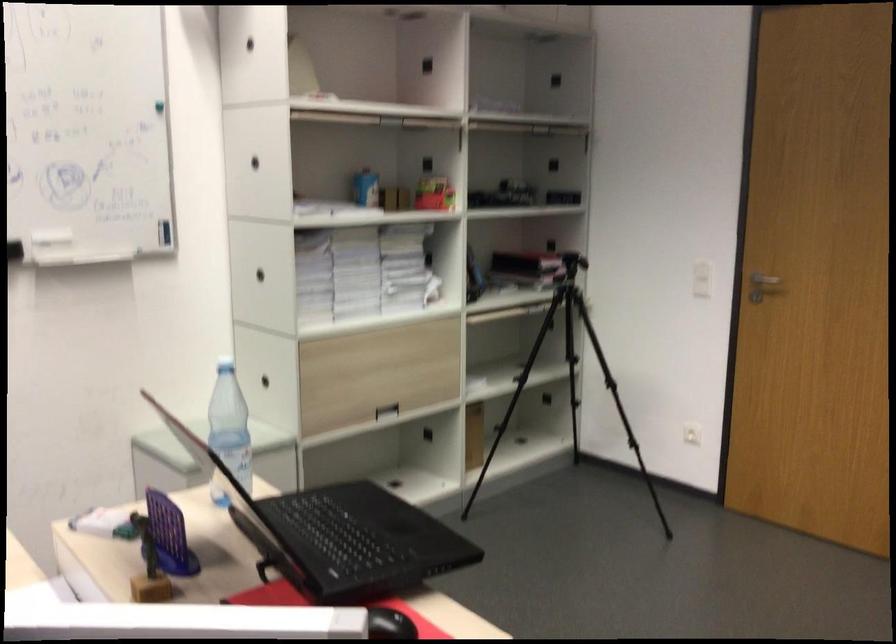
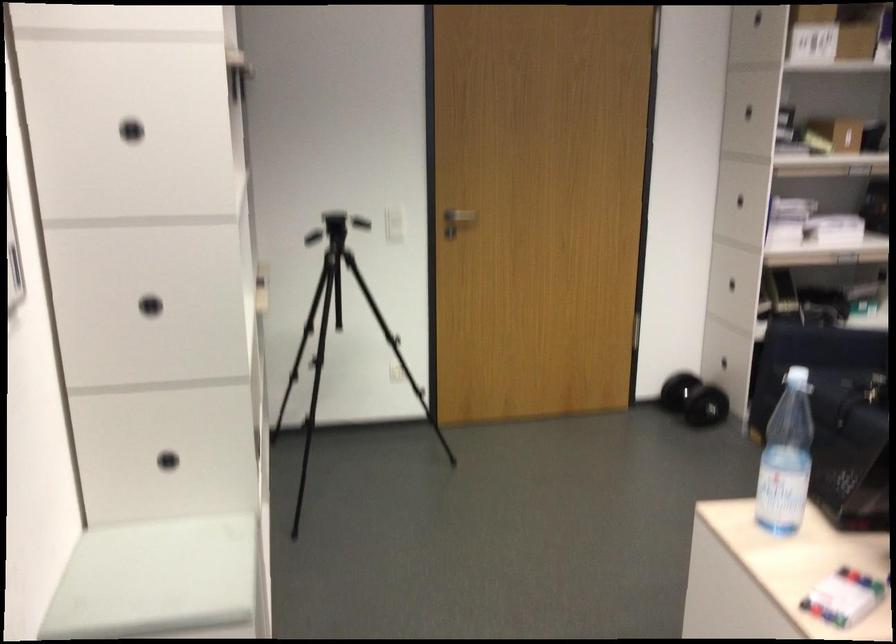
Locate, in the second image, the point that corresponds to point 291,391 in the first image.

(167, 460)